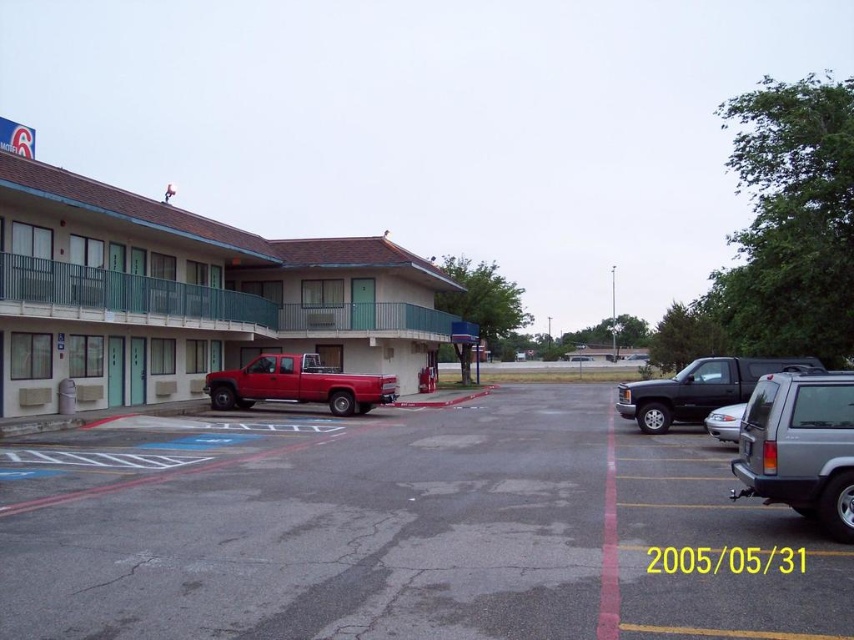
The width and height of the screenshot is (854, 640). I want to click on smooth asphalt parking lot at center, so tap(398, 529).

Looking at this image, which is more to the right, matte teal hotel at left or silver metallic sedan at center-right?

silver metallic sedan at center-right

Is matte teal hotel at left below silver metallic sedan at center-right?

Actually, matte teal hotel at left is above silver metallic sedan at center-right.

Identify the location of matte teal hotel at left. The image size is (854, 640). (186, 296).

Locate an element on the screen. matte teal hotel at left is located at coordinates (186, 296).

Between point (108, 353) and point (852, 408), which one is positioned behind?

The point (108, 353) is more distant.

Between point (361, 273) and point (817, 451), which one is positioned behind?

Point (361, 273)

Locate an element on the screen. This screenshot has height=640, width=854. matte teal hotel at left is located at coordinates (186, 296).